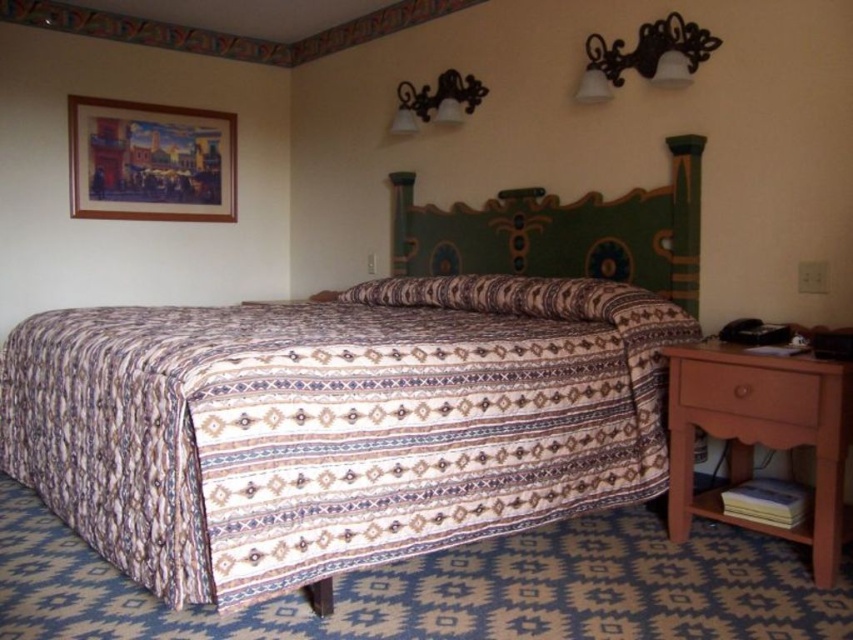
You are standing in the bedroom and want to place a small plant on the brown wood drawer at lower right. Where exactly should you place it?

The brown wood drawer at lower right is located at coordinates point [747,390], so place the plant there.

You are standing in the bedroom and want to place a small nightstand between the patterned fabric bed at center and the green painted wood headboard at upper center. Is there enough space for the nightstand?

The patterned fabric bed at center is positioned under the green painted wood headboard at upper center, so there is no space between them for a nightstand.